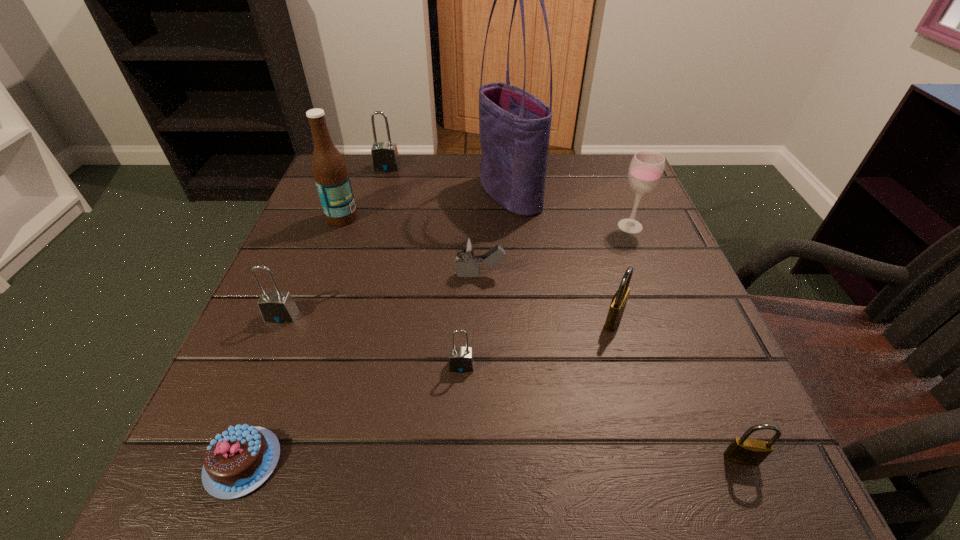
You are a GUI agent. You are given a task and a screenshot of the screen. Output one action in this format:
    pyautogui.click(x=<x>, y=<y>)
    Task: Click on the free region located on the left of the wineglass
    This screenshot has height=540, width=960.
    Given the screenshot: What is the action you would take?
    pyautogui.click(x=482, y=226)

Where is `free space located on the shackle of the farthest gray padlock`? This screenshot has width=960, height=540. free space located on the shackle of the farthest gray padlock is located at coordinates (360, 261).

In order to click on vacant space positioned on the shackle of the leftmost padlock in this screenshot , I will do `click(262, 362)`.

This screenshot has height=540, width=960. I want to click on free location located on the left of the farther brass padlock, so click(521, 320).

You are a GUI agent. You are given a task and a screenshot of the screen. Output one action in this format:
    pyautogui.click(x=<x>, y=<y>)
    Task: Click on the vacant space positioned 0.350m on the right of the gray igniter
    The width and height of the screenshot is (960, 540).
    Given the screenshot: What is the action you would take?
    (687, 275)

At what (x,y) coordinates should I click in order to perform the action: click on free point located 0.180m on the shackle of the second nearest padlock. Please return your answer as a coordinate pair (x, y). Looking at the image, I should click on click(457, 494).

Locate an element on the screen. Image resolution: width=960 pixels, height=540 pixels. blank area located 0.150m on the left of the right brass padlock is located at coordinates (612, 458).

This screenshot has height=540, width=960. Identify the location of vacant space situated on the back of the pink chocolate cake. (293, 334).

Where is `tote bag located at the far edge`? This screenshot has width=960, height=540. tote bag located at the far edge is located at coordinates (514, 126).

The image size is (960, 540). Identify the location of padlock at the far edge. (385, 158).